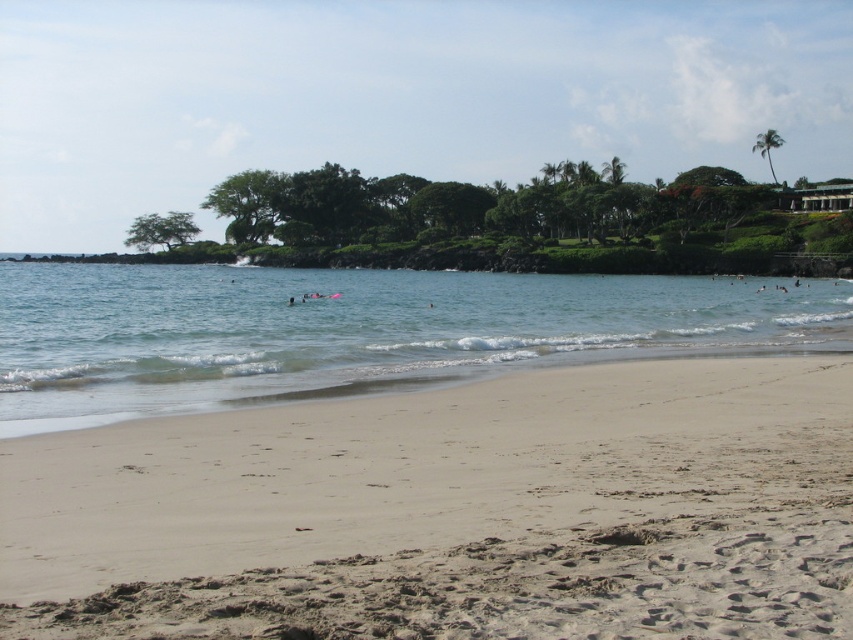
You are standing on the beach and see two points marked in the image. The first point is at coordinates point [148,477] and the second is at point [595,298]. Which point is closer to you?

Point [148,477] is in front of point [595,298], so it is closer to you.

You are standing at the center of the beach and want to walk to the light beige sand at lower center. Which direction should you move in?

The light beige sand at lower center is located at point 0.800 on the x axis and 0.531 on the y axis. Since you are at the center, you should move towards the lower right direction to reach it.

You are standing on the light beige sand at lower center and want to reach the clear blue water at center. Which direction should you move to get there?

You should move upward because the light beige sand at lower center is below the clear blue water at center.